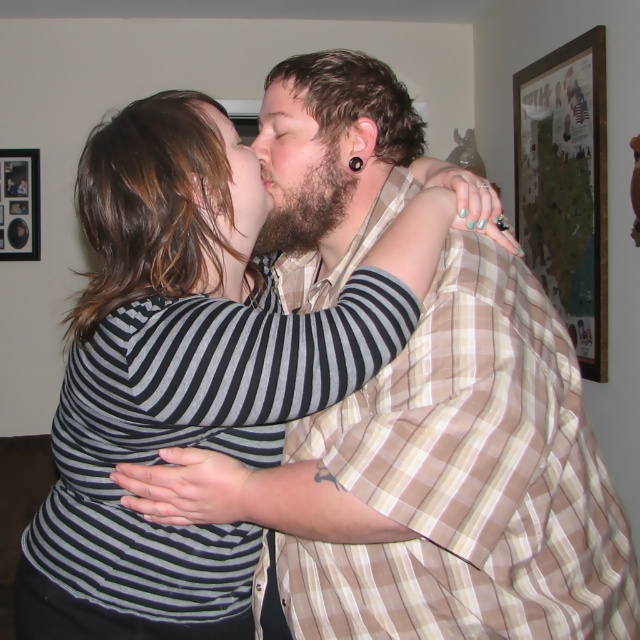
You are an interior designer assessing the wall space in this room. You need to hang a new picture that is the same height as the bearded man at center. Will the wooden framed map at upper right fit in the same space?

The wooden framed map at upper right has a greater height compared to the bearded man at center, so it would not fit in the same space reserved for the bearded man at center.

Looking at this image, you are an interior designer assessing the wall space in this image. You need to hang a new rectangular artwork that is 1 meter wide. The wooden framed map at upper right and the bearded man at center are currently occupying the wall. Considering their widths, can the new artwork fit between them without overlapping?

The wooden framed map at upper right is thinner than bearded man at center. Since the new artwork is 1 meter wide, and the map is thinner than the bearded man, it depends on the combined width of both objects. However, without exact measurements, it is uncertain if there is enough space between them for the new artwork.